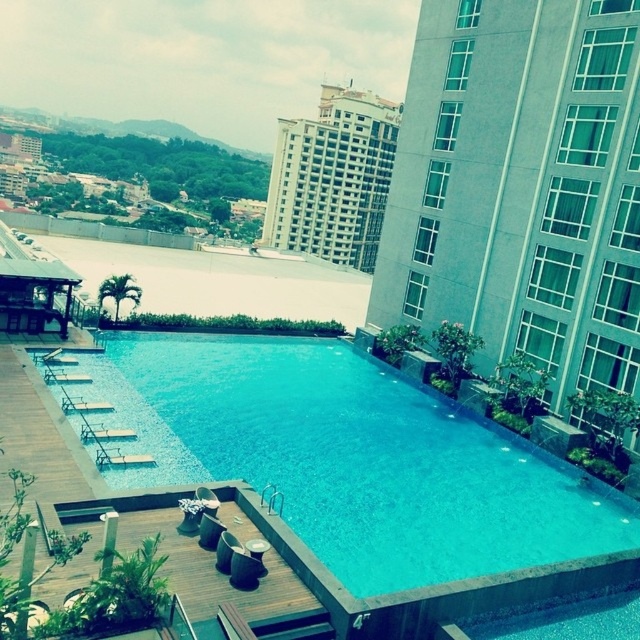
In the scene shown: You are a drone operator tasked with flying a drone from the white glass building at upper right to the white glossy building at upper center. The drone has a maximum flight range of 150 meters. Can the drone complete this journey without needing to recharge?

The white glass building at upper right is 139.16 meters away from the white glossy building at upper center. Since the distance is less than the drone maximum flight range of 150 meters, the drone can complete the journey without needing to recharge.

From the picture: You are a guest staying at this rooftop hotel and want to know if the blue tile swimming pool at center is wider than the white glossy building at upper center. Can you confirm?

The blue tile swimming pool at center is thinner than the white glossy building at upper center, so no, the pool is not wider than the building.

You are standing at the edge of the blue tile swimming pool at center and looking towards the white glossy building at upper center. Which object is closer to you?

The blue tile swimming pool at center is closer to you than the white glossy building at upper center.